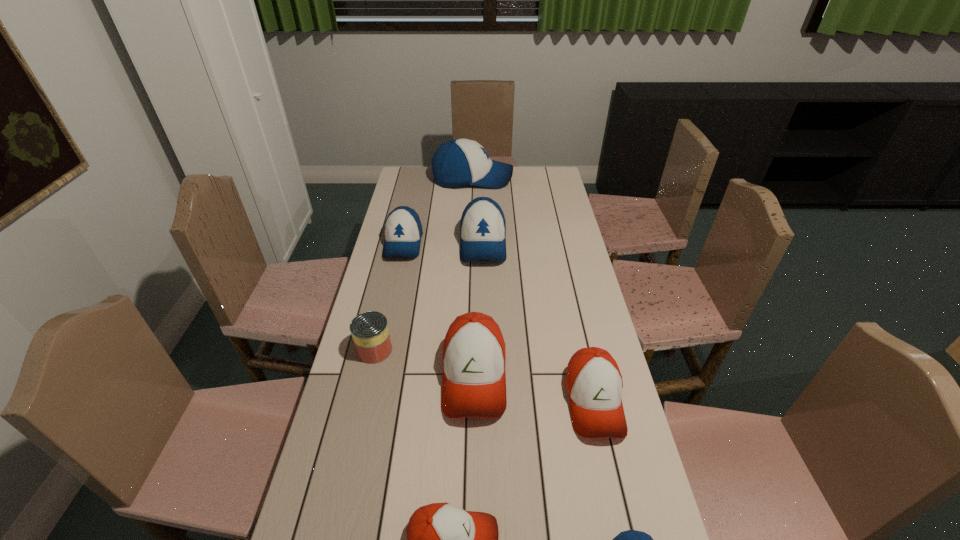
Identify the location of vacant space that's between the second smallest blue baseball cap and the second biggest blue baseball cap. The width and height of the screenshot is (960, 540). (444, 244).

Find the location of a particular element. vacant point located between the biggest orange baseball cap and the rightmost orange baseball cap is located at coordinates [x=534, y=389].

The height and width of the screenshot is (540, 960). I want to click on vacant point located between the third biggest blue baseball cap and the second biggest blue baseball cap, so click(444, 244).

Identify the location of empty space that is in between the second biggest orange baseball cap and the farthest blue baseball cap. Image resolution: width=960 pixels, height=540 pixels. (533, 290).

Identify the location of free space between the biggest orange baseball cap and the farthest baseball cap. (473, 278).

Find the location of a particular element. vacant region between the third smallest blue baseball cap and the can is located at coordinates (429, 296).

I want to click on vacant space that is in between the can and the farthest object, so click(x=423, y=264).

Where is `free spot between the second biggest orange baseball cap and the biggest blue baseball cap`? This screenshot has width=960, height=540. free spot between the second biggest orange baseball cap and the biggest blue baseball cap is located at coordinates (533, 290).

Where is `the seventh closest object to the farthest blue baseball cap`? The height and width of the screenshot is (540, 960). the seventh closest object to the farthest blue baseball cap is located at coordinates (631, 539).

Choose which object is the nearest neighbor to the nearest blue baseball cap. Please provide its 2D coordinates. Your answer should be formatted as a tuple, i.e. [(x, y)], where the tuple contains the x and y coordinates of a point satisfying the conditions above.

[(594, 384)]